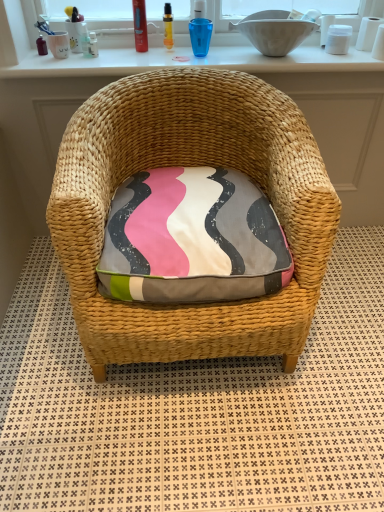
Identify the location of free location to the right of shiny red can at upper center, marked as the 2th toiletry in a right-to-left arrangement. (185, 58).